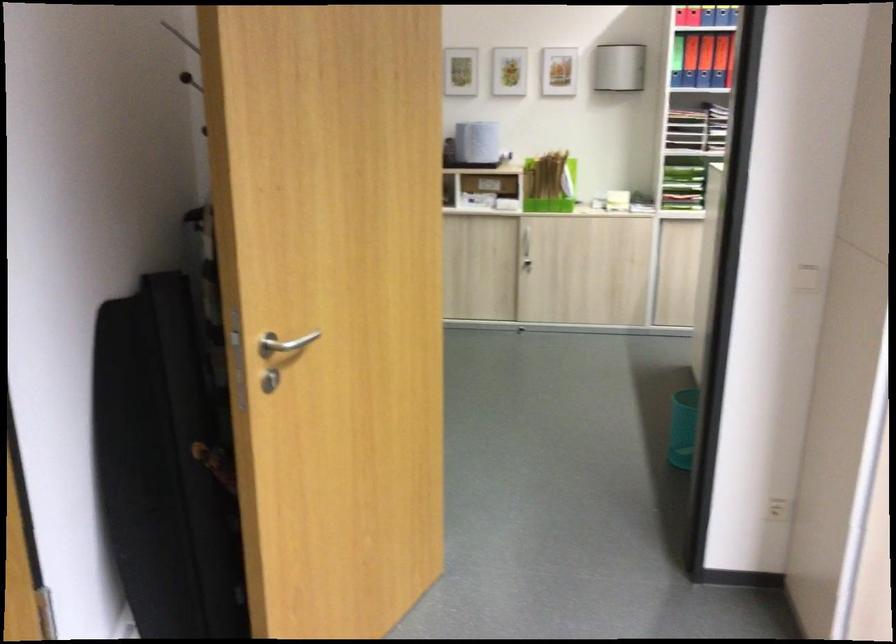
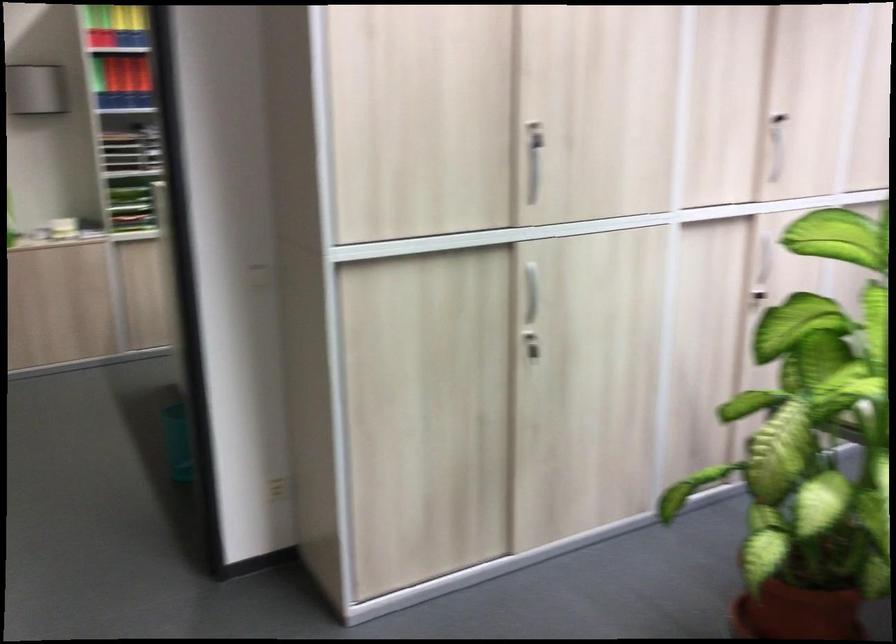
Question: The camera is either moving clockwise (left) or counter-clockwise (right) around the object. The first image is from the beginning of the video and the second image is from the end. Is the camera moving left or right when shooting the video?

Choices:
 (A) Left
 (B) Right

Answer: (A)